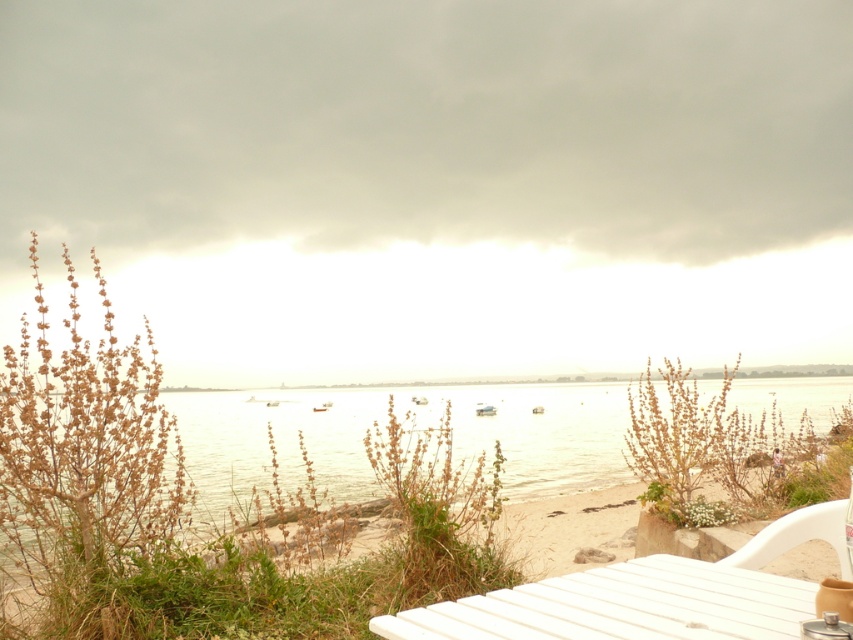
Does white wood table at lower right appear over white plastic chair at lower right?

Yes, white wood table at lower right is above white plastic chair at lower right.

Can you confirm if white wood table at lower right is positioned to the left of white plastic chair at lower right?

Correct, you'll find white wood table at lower right to the left of white plastic chair at lower right.

Describe the element at coordinates (621, 605) in the screenshot. I see `white wood table at lower right` at that location.

At what (x,y) coordinates should I click in order to perform the action: click on white wood table at lower right. Please return your answer as a coordinate pair (x, y). The width and height of the screenshot is (853, 640). Looking at the image, I should click on (621, 605).

Looking at this image, which is more to the right, clear water at center or white plastic chair at lower right?

Positioned to the right is clear water at center.

Between point (219, 420) and point (775, 529), which one is positioned behind?

The point (219, 420) is behind.

At what (x,y) coordinates should I click in order to perform the action: click on clear water at center. Please return your answer as a coordinate pair (x, y). Looking at the image, I should click on (421, 428).

Is clear water at center positioned behind white wood table at lower right?

Yes.

Is point (614, 470) closer to viewer compared to point (688, 588)?

No, it is not.

What do you see at coordinates (421, 428) in the screenshot? I see `clear water at center` at bounding box center [421, 428].

What are the coordinates of `clear water at center` in the screenshot? It's located at (421, 428).